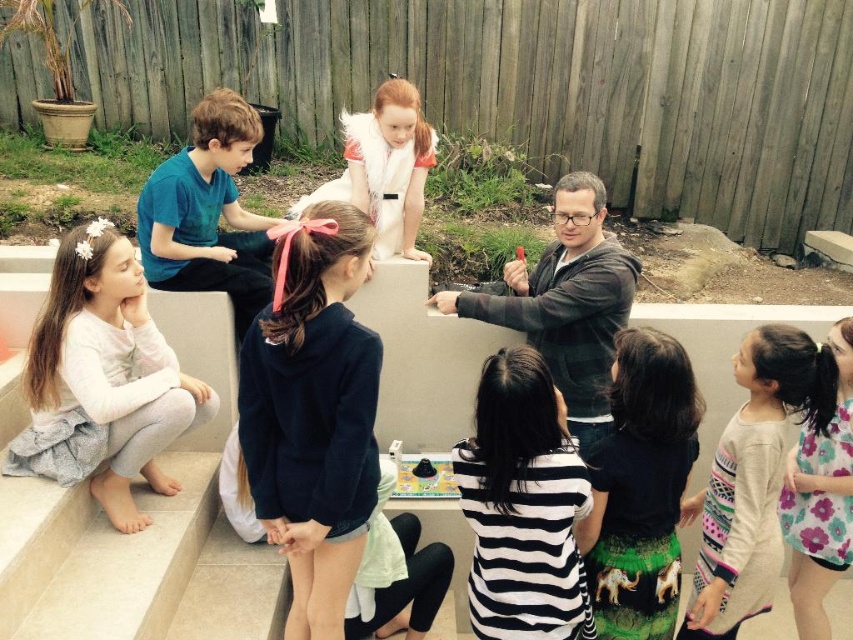
Who is taller, gray cotton dress at lower left or green elephant-patterned skirt at lower right?

gray cotton dress at lower left

What do you see at coordinates (102, 380) in the screenshot? This screenshot has width=853, height=640. I see `gray cotton dress at lower left` at bounding box center [102, 380].

Find the location of a particular element. gray cotton dress at lower left is located at coordinates (102, 380).

Can you confirm if gray cotton dress at lower left is smaller than striped cotton shirt at lower right?

No, gray cotton dress at lower left is not smaller than striped cotton shirt at lower right.

Locate an element on the screen. Image resolution: width=853 pixels, height=640 pixels. gray cotton dress at lower left is located at coordinates (102, 380).

This screenshot has width=853, height=640. In order to click on gray cotton dress at lower left in this screenshot , I will do `click(102, 380)`.

The height and width of the screenshot is (640, 853). Identify the location of gray cotton dress at lower left. (102, 380).

Can you confirm if green elephant-patterned skirt at lower right is taller than gray fleece jacket at center?

No, green elephant-patterned skirt at lower right is not taller than gray fleece jacket at center.

Which is behind, point (660, 428) or point (540, 317)?

The point (540, 317) is behind.

Which is in front, point (618, 520) or point (560, 362)?

Point (618, 520) is in front.

Where is `green elephant-patterned skirt at lower right`? The height and width of the screenshot is (640, 853). green elephant-patterned skirt at lower right is located at coordinates (640, 486).